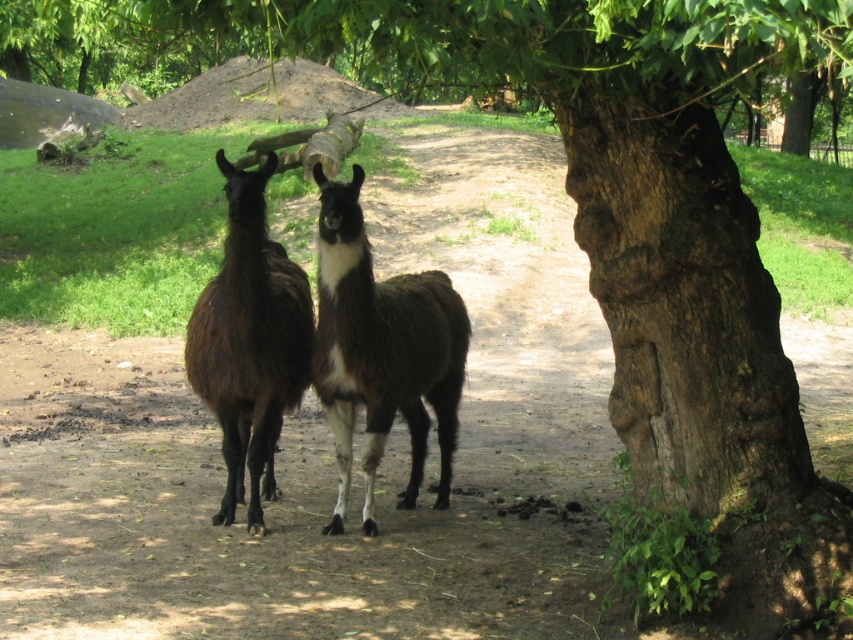
You are a farmer who needs to separate two alpacas using a fence. The minimum distance required between the alpacas for the fence to be effective is 20 inches. Based on the image, will the fence work if placed between the brown fuzzy llama at center and the brown fuzzy llama at left?

The brown fuzzy llama at center is 20.17 inches from the brown fuzzy llama at left. Since the required distance is 20 inches, the fence will work as the distance meets the requirement.